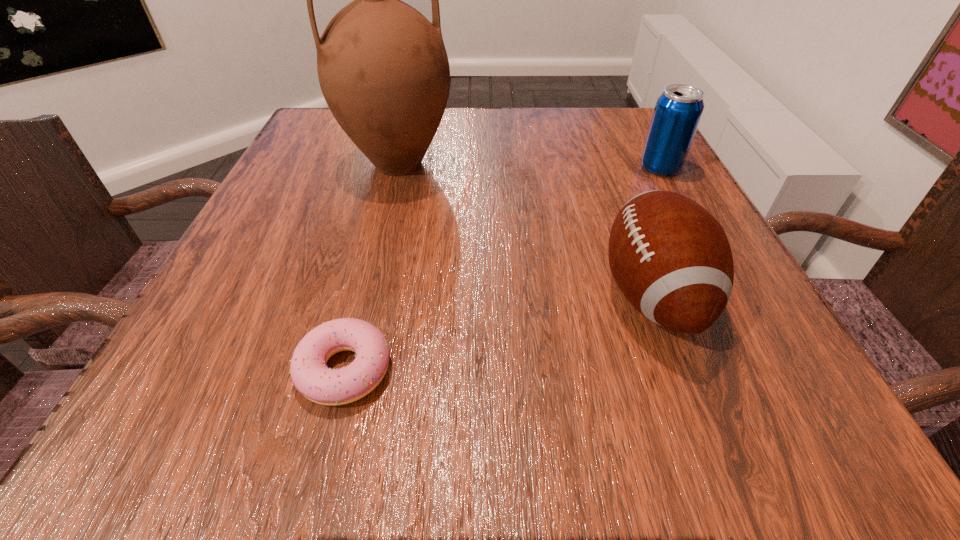
Locate an element on the screen. The width and height of the screenshot is (960, 540). pitcher that is at the far edge is located at coordinates (383, 69).

Where is `pop soda that is positioned at the far edge`? Image resolution: width=960 pixels, height=540 pixels. pop soda that is positioned at the far edge is located at coordinates coord(678,110).

At what (x,y) coordinates should I click in order to perform the action: click on object present at the near edge. Please return your answer as a coordinate pair (x, y). The width and height of the screenshot is (960, 540). Looking at the image, I should click on [x=310, y=375].

Locate an element on the screen. The height and width of the screenshot is (540, 960). object positioned at the left edge is located at coordinates (383, 69).

At what (x,y) coordinates should I click in order to perform the action: click on pop soda located in the right edge section of the desktop. Please return your answer as a coordinate pair (x, y). The image size is (960, 540). Looking at the image, I should click on (678, 110).

Image resolution: width=960 pixels, height=540 pixels. In order to click on football located at the right edge in this screenshot , I will do `click(671, 259)`.

The image size is (960, 540). I want to click on object that is positioned at the far left corner, so click(383, 69).

The width and height of the screenshot is (960, 540). I want to click on object that is positioned at the far right corner, so click(x=678, y=110).

Identify the location of vacant area at the far edge of the desktop. (510, 137).

Locate an element on the screen. The width and height of the screenshot is (960, 540). vacant space at the near edge of the desktop is located at coordinates (612, 432).